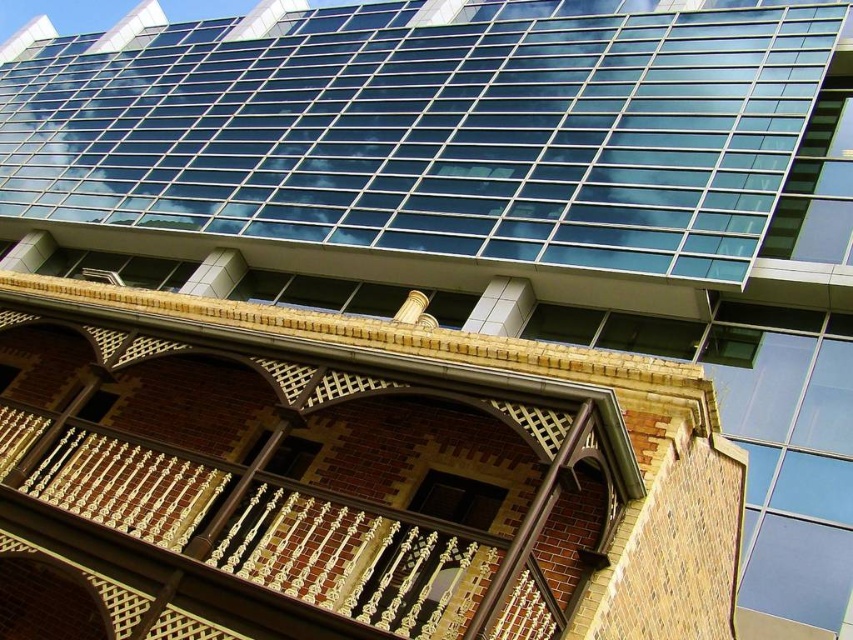
You are an architect analyzing the spatial relationship between the transparent glass windows at upper center and the brown brick balcony at center. Which one appears closer to the viewer in the image?

The transparent glass windows at upper center appear closer to the viewer than the brown brick balcony at center because they are positioned further to the viewer in the image.

You are an architect analyzing the building facade. Which object, the transparent glass windows at upper center or the brown brick balcony at center, has a greater vertical height in the image?

The transparent glass windows at upper center is taller than the brown brick balcony at center, so the transparent glass windows at upper center has a greater vertical height.

You are an architect evaluating the structural integrity of the building. The transparent glass windows at upper center and the brown brick balcony at center are both subject to wind pressure. Given their sizes, which one might require additional reinforcement to withstand strong winds?

The transparent glass windows at upper center has a larger size compared to the brown brick balcony at center, so it might require additional reinforcement to withstand strong winds due to its larger surface area exposed to wind pressure.